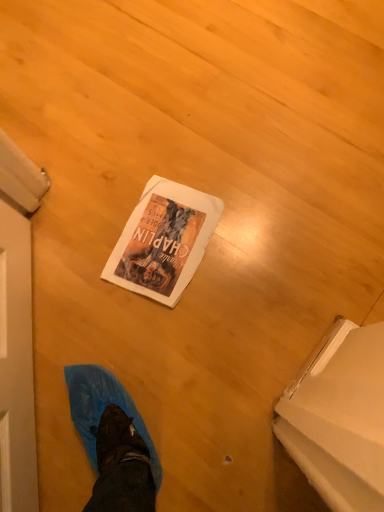
I want to click on white paper comic book at center, so click(163, 241).

Image resolution: width=384 pixels, height=512 pixels. Describe the element at coordinates (163, 241) in the screenshot. I see `white paper comic book at center` at that location.

At what (x,y) coordinates should I click in order to perform the action: click on white paper comic book at center. Please return your answer as a coordinate pair (x, y). Image resolution: width=384 pixels, height=512 pixels. Looking at the image, I should click on (163, 241).